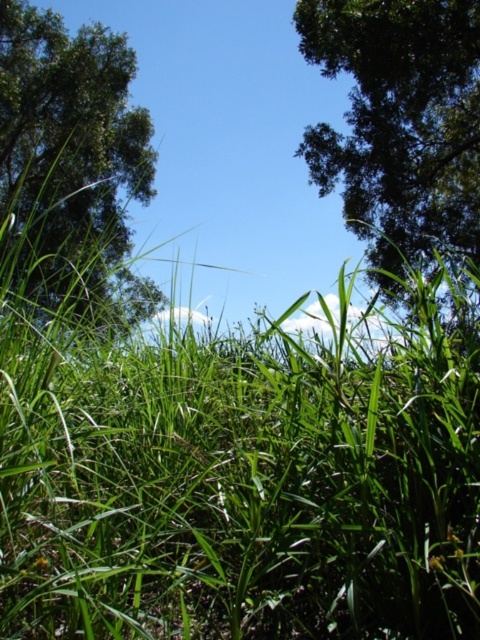
Can you confirm if green leafy tree at upper right is bigger than green leafy tree at upper left?

Incorrect, green leafy tree at upper right is not larger than green leafy tree at upper left.

Does green leafy tree at upper right come in front of green leafy tree at upper left?

No, green leafy tree at upper right is further to the viewer.

Does point (320, 44) lie behind point (97, 140)?

That is False.

This screenshot has height=640, width=480. In order to click on green leafy tree at upper right in this screenshot , I will do `click(399, 116)`.